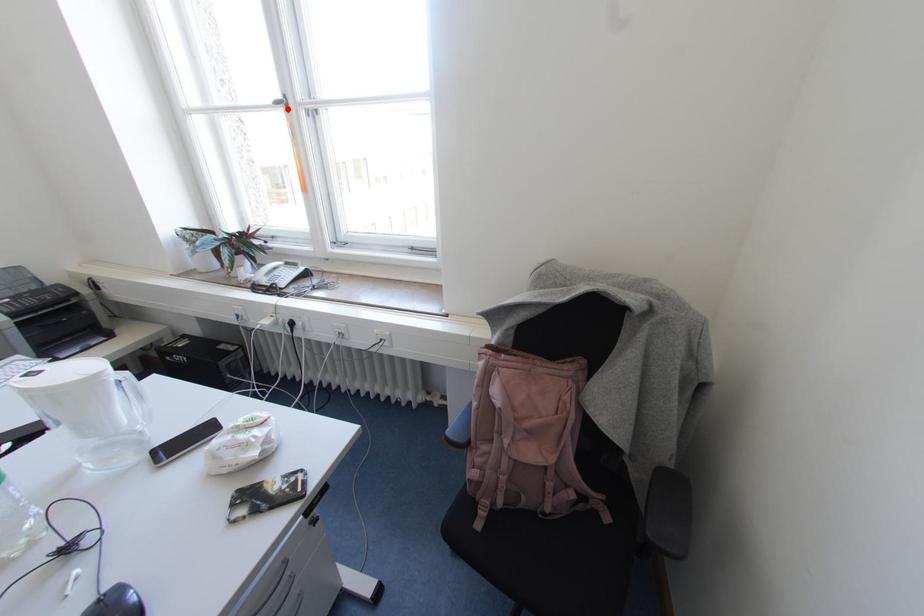
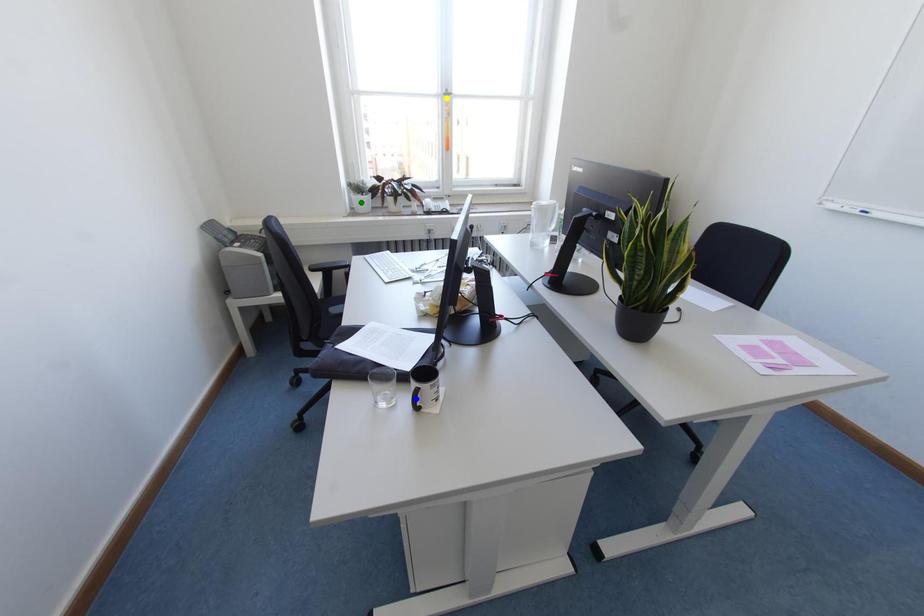
Question: I am providing you with two images of the same scene from different viewpoints. A red point is marked on the first image. You are given multiple points on the second image. Which point in image 2 is actually the same real-world point as the red point in image 1?

Choices:
 (A) yellow point
 (B) blue point
 (C) green point

Answer: (A)